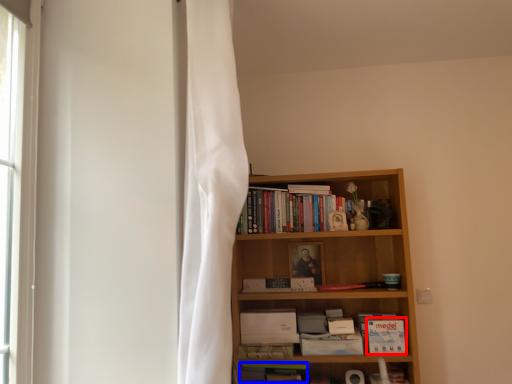
Question: Which of the following is the closest to the observer, paperback book (highlighted by a red box) or book (highlighted by a blue box)?

Choices:
 (A) paperback book
 (B) book

Answer: (A)